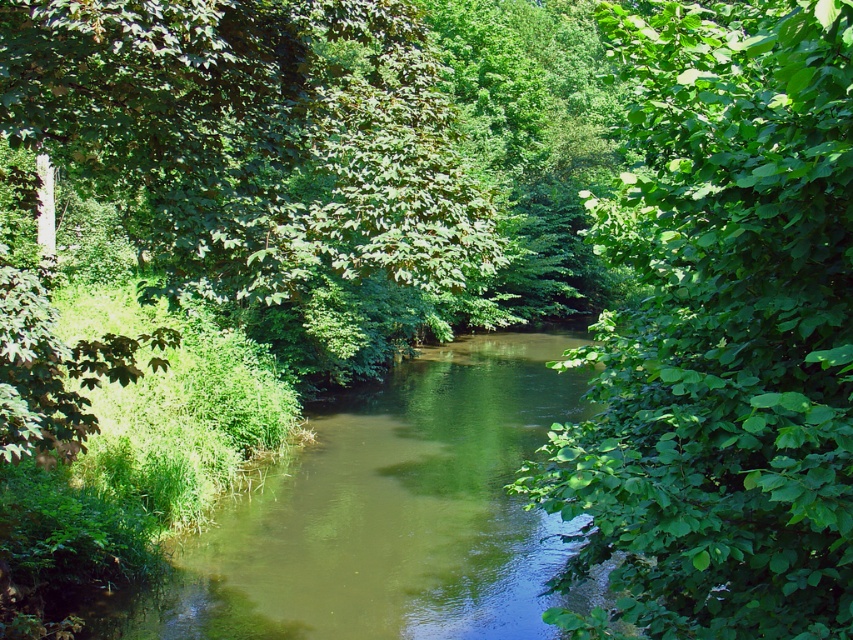
You are standing on the bank of the river and want to know which object in the scene is taller. The objects you can see are the green leafy tree at center right and the green smooth water at center. Can you tell me which one is taller?

The green leafy tree at center right is taller than the green smooth water at center.

You are a bird flying over the serene natural scene. You notice the green leafy tree at upper left and the green smooth water at center. Which object is taller when viewed from above?

The green smooth water at center is taller than the green leafy tree at upper left according to the description.

You are standing at the edge of the river in the image. There is a point marked at coordinates point (721, 333). Which object in the scene does this point belong to?

The point (721, 333) is on the green leafy tree at center right.